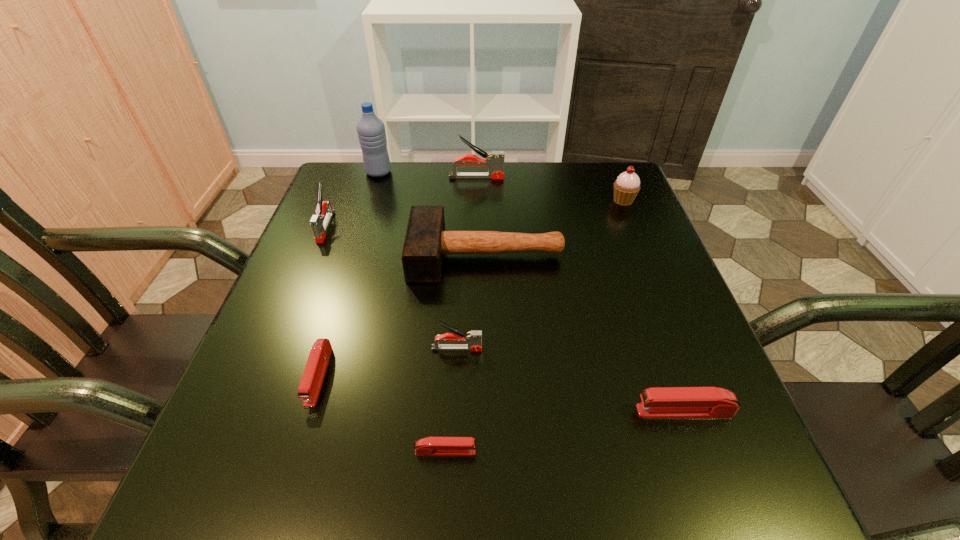
The width and height of the screenshot is (960, 540). Find the location of `vacant area located on the hammer head face of the mallet`. vacant area located on the hammer head face of the mallet is located at coordinates (315, 255).

Identify the location of free spot located on the hammer head face of the mallet. The width and height of the screenshot is (960, 540). (301, 255).

Find the location of `vacant space located 0.200m on the hammer head face of the mallet`. vacant space located 0.200m on the hammer head face of the mallet is located at coordinates (320, 255).

The height and width of the screenshot is (540, 960). I want to click on free space located 0.140m on the front-facing side of the biggest red stapler, so click(550, 411).

Identify the location of blank space located 0.230m on the front-facing side of the biggest red stapler. (493, 411).

This screenshot has width=960, height=540. What are the coordinates of `vacant space situated on the front-facing side of the biggest red stapler` in the screenshot? It's located at (543, 411).

Identify the location of free space located 0.120m on the front-facing side of the eighth tallest object. The image size is (960, 540). (285, 484).

Find the location of a particular element. free region located on the front-facing side of the shortest stapler is located at coordinates (670, 451).

Locate an element on the screen. The width and height of the screenshot is (960, 540). water bottle at the far edge is located at coordinates (371, 131).

Locate an element on the screen. stapler located in the far edge section of the desktop is located at coordinates (494, 161).